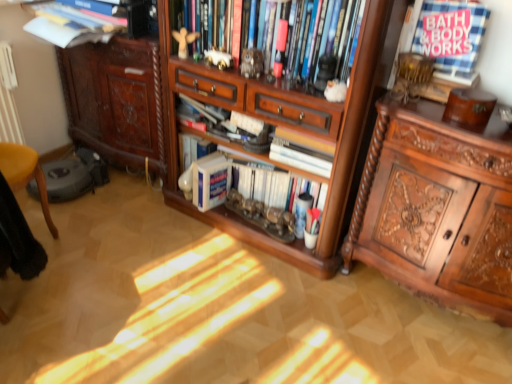
Question: Is wooden bookshelf at upper center, which appears as the fifth book when ordered from the bottom, wider than white porcelain elephant at upper center, the third toy when ordered from front to back?

Choices:
 (A) no
 (B) yes

Answer: (B)

Question: Is wooden bookshelf at upper center, which appears as the fifth book when ordered from the bottom, not near white porcelain elephant at upper center, the second toy positioned from the left?

Choices:
 (A) yes
 (B) no

Answer: (B)

Question: Does wooden bookshelf at upper center, which appears as the fifth book when ordered from the bottom, lie behind white porcelain elephant at upper center, which is the second toy from back to front?

Choices:
 (A) yes
 (B) no

Answer: (B)

Question: From the image's perspective, is wooden bookshelf at upper center, which appears as the fifth book when ordered from the bottom, below white porcelain elephant at upper center, the third toy when ordered from front to back?

Choices:
 (A) yes
 (B) no

Answer: (B)

Question: Is wooden bookshelf at upper center, positioned as the first book in top-to-bottom order, shorter than white porcelain elephant at upper center, which appears as the third toy when viewed from the right?

Choices:
 (A) no
 (B) yes

Answer: (A)

Question: Is white porcelain elephant at upper center, which appears as the third toy when viewed from the right, in front of or behind white matte book at center, which ranks as the first book in bottom-to-top order, in the image?

Choices:
 (A) front
 (B) behind

Answer: (A)

Question: In terms of height, does white porcelain elephant at upper center, which appears as the third toy when viewed from the right, look taller or shorter compared to white matte book at center, arranged as the 5th book when viewed from the top?

Choices:
 (A) tall
 (B) short

Answer: (B)

Question: Which is correct: white porcelain elephant at upper center, which appears as the third toy when viewed from the right, is inside white matte book at center, which ranks as the first book in bottom-to-top order, or outside of it?

Choices:
 (A) inside
 (B) outside

Answer: (B)

Question: Would you say white porcelain elephant at upper center, which appears as the third toy when viewed from the right, is to the left or to the right of white matte book at center, which ranks as the first book in bottom-to-top order, in the picture?

Choices:
 (A) left
 (B) right

Answer: (B)

Question: From the image's perspective, relative to white paper at center, which is the third book in top-to-bottom order, is metallic statue at center, marked as the 3th toy in a back-to-front arrangement, above or below?

Choices:
 (A) above
 (B) below

Answer: (A)

Question: Considering their positions, is metallic statue at center, the 3th toy when ordered from left to right, located in front of or behind white paper at center, which is the third book in top-to-bottom order?

Choices:
 (A) behind
 (B) front

Answer: (B)

Question: Is point (261, 64) closer or farther from the camera than point (289, 162)?

Choices:
 (A) closer
 (B) farther

Answer: (A)

Question: Looking at the image, does metallic statue at center, which is counted as the 2th toy, starting from the right, seem bigger or smaller compared to white paper at center, which is counted as the third book, starting from the bottom?

Choices:
 (A) big
 (B) small

Answer: (B)

Question: Is point (282, 132) closer or farther from the camera than point (361, 39)?

Choices:
 (A) farther
 (B) closer

Answer: (A)

Question: Considering the positions of white paper at center, which is the third book in top-to-bottom order, and wooden cabinet at center in the image, is white paper at center, which is the third book in top-to-bottom order, wider or thinner than wooden cabinet at center?

Choices:
 (A) thin
 (B) wide

Answer: (A)